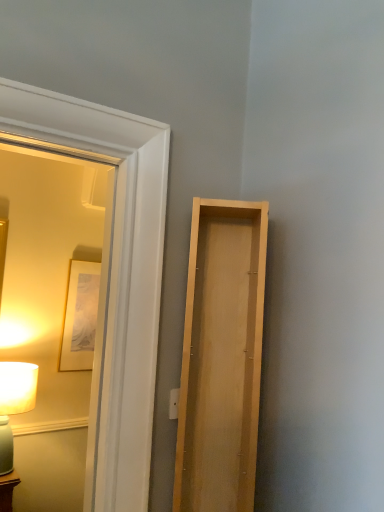
Question: Are matte white lamp at left and light wood door at right beside each other?

Choices:
 (A) yes
 (B) no

Answer: (B)

Question: Is matte white lamp at left aimed at light wood door at right?

Choices:
 (A) yes
 (B) no

Answer: (A)

Question: Considering the relative positions of matte white lamp at left and light wood door at right in the image provided, is matte white lamp at left to the left of light wood door at right from the viewer's perspective?

Choices:
 (A) no
 (B) yes

Answer: (B)

Question: Considering the relative sizes of matte white lamp at left and light wood door at right in the image provided, is matte white lamp at left shorter than light wood door at right?

Choices:
 (A) yes
 (B) no

Answer: (A)

Question: Considering the relative sizes of matte white lamp at left and light wood door at right in the image provided, is matte white lamp at left taller than light wood door at right?

Choices:
 (A) no
 (B) yes

Answer: (A)

Question: Is matte white lamp at left not close to light wood door at right?

Choices:
 (A) no
 (B) yes

Answer: (B)

Question: Is matte white lamp at left inside light wood door at right?

Choices:
 (A) yes
 (B) no

Answer: (B)

Question: Is light wood door at right not inside matte white lamp at left?

Choices:
 (A) no
 (B) yes

Answer: (B)

Question: From a real-world perspective, is light wood door at right over matte white lamp at left?

Choices:
 (A) no
 (B) yes

Answer: (B)

Question: Can you confirm if light wood door at right is positioned to the left of matte white lamp at left?

Choices:
 (A) yes
 (B) no

Answer: (B)

Question: From a real-world perspective, is light wood door at right below matte white lamp at left?

Choices:
 (A) yes
 (B) no

Answer: (B)

Question: Does light wood door at right appear on the right side of matte white lamp at left?

Choices:
 (A) yes
 (B) no

Answer: (A)

Question: Is matte wooden mirror at left bigger than matte white lamp at left?

Choices:
 (A) no
 (B) yes

Answer: (B)